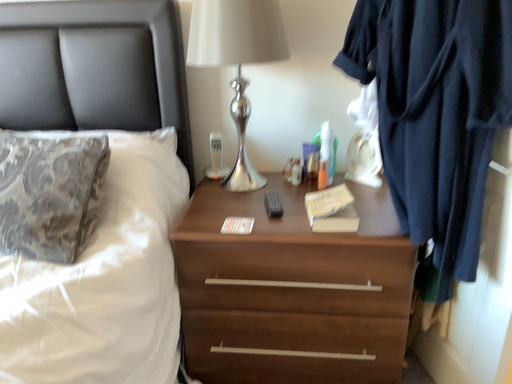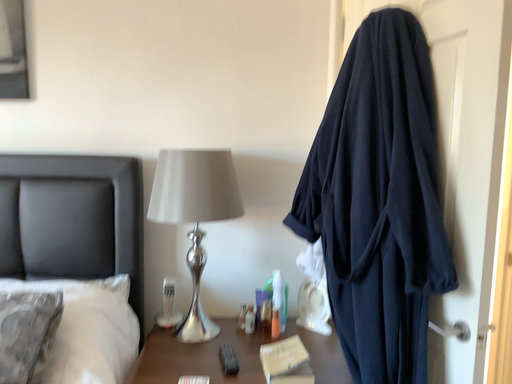
Question: How did the camera likely rotate when shooting the video?

Choices:
 (A) rotated left
 (B) rotated right

Answer: (B)